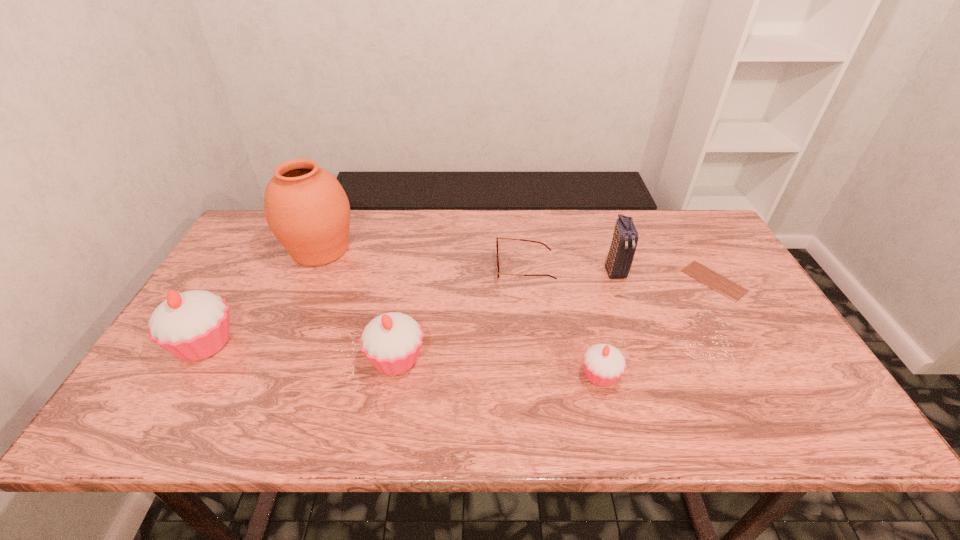
Find the location of a particular element. The width and height of the screenshot is (960, 540). the shortest object is located at coordinates (719, 283).

Find the location of `vacant area situated 0.320m on the back of the leftmost cupcake`. vacant area situated 0.320m on the back of the leftmost cupcake is located at coordinates (264, 244).

What are the coordinates of `free region located on the left of the third object from left to right` in the screenshot? It's located at (324, 359).

What are the coordinates of `free location located 0.310m on the back of the rightmost cupcake` in the screenshot? It's located at (576, 273).

Where is `blank area located with the zip open on the clutch bag`? This screenshot has height=540, width=960. blank area located with the zip open on the clutch bag is located at coordinates (639, 341).

At what (x,y) coordinates should I click in order to perform the action: click on vacant space situated on the right of the urn. Please return your answer as a coordinate pair (x, y). The image size is (960, 540). Looking at the image, I should click on (409, 249).

Where is `vacant area situated on the face of the second shortest object`? The width and height of the screenshot is (960, 540). vacant area situated on the face of the second shortest object is located at coordinates 419,268.

This screenshot has width=960, height=540. Identify the location of vacant space located on the face of the second shortest object. (x=456, y=268).

At what (x,y) coordinates should I click in order to perform the action: click on vacant space located on the face of the second shortest object. Please return your answer as a coordinate pair (x, y). The image size is (960, 540). Looking at the image, I should click on (419, 268).

Identify the location of vacant region located 0.230m on the front of the shortest object. (768, 373).